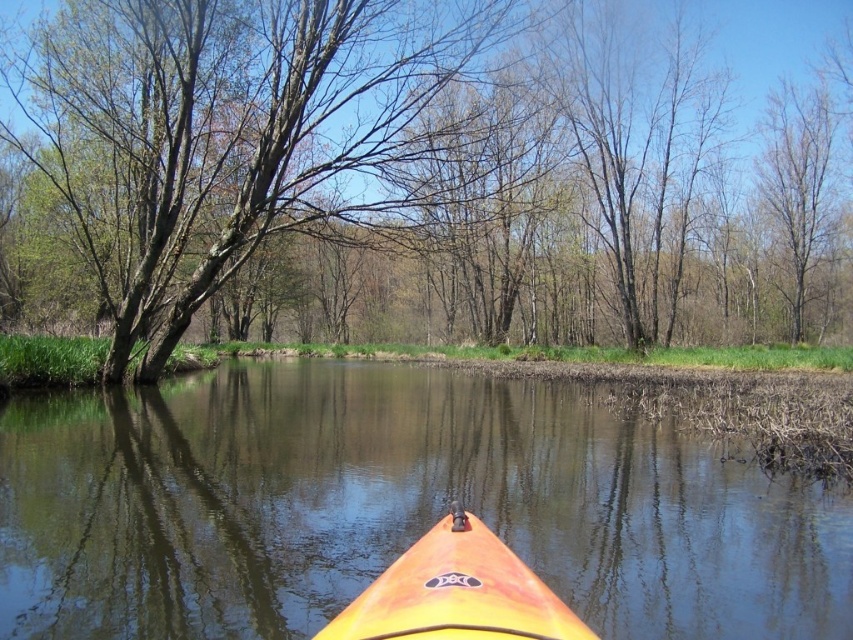
Question: Is brown bark tree at center positioned behind orange plastic kayak at center?

Choices:
 (A) yes
 (B) no

Answer: (A)

Question: Considering the relative positions of brown bark tree at center and orange plastic kayak at center in the image provided, where is brown bark tree at center located with respect to orange plastic kayak at center?

Choices:
 (A) left
 (B) right

Answer: (B)

Question: Does brown bark tree at center appear over orange matte kayak at center?

Choices:
 (A) no
 (B) yes

Answer: (B)

Question: Which point is closer to the camera?

Choices:
 (A) brown bark tree at center
 (B) orange plastic kayak at center

Answer: (B)

Question: Which point is closer to the camera?

Choices:
 (A) orange matte kayak at center
 (B) brown bark tree at center

Answer: (A)

Question: Among these objects, which one is nearest to the camera?

Choices:
 (A) orange plastic kayak at center
 (B) brown bark tree at center
 (C) orange matte kayak at center

Answer: (C)